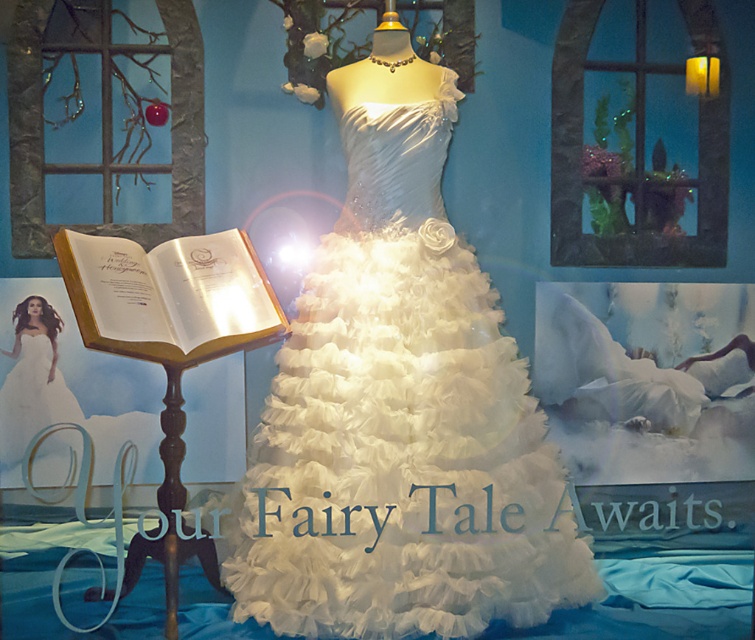
Does point (359, 296) lie behind point (666, 417)?

No, it is in front of (666, 417).

Is the position of white tulle dress at center less distant than that of white fluffy dress at center?

Yes, white tulle dress at center is in front of white fluffy dress at center.

The height and width of the screenshot is (640, 755). What do you see at coordinates (401, 426) in the screenshot?
I see `white tulle dress at center` at bounding box center [401, 426].

Identify the location of white tulle dress at center. This screenshot has height=640, width=755. (401, 426).

Who is lower down, white tulle dress at center or translucent glass at upper right?

Positioned lower is white tulle dress at center.

Between white tulle dress at center and translucent glass at upper right, which one has more height?

Standing taller between the two is white tulle dress at center.

Between point (427, 211) and point (604, 216), which one is positioned in front?

Point (427, 211)

This screenshot has width=755, height=640. I want to click on white tulle dress at center, so click(401, 426).

Who is more forward, (556, 232) or (14, 458)?

Point (14, 458) is more forward.

Can you confirm if translucent glass at upper right is positioned to the left of white tulle dress at left?

In fact, translucent glass at upper right is to the right of white tulle dress at left.

The width and height of the screenshot is (755, 640). Identify the location of translucent glass at upper right. (636, 141).

Find the location of a particular element. This screenshot has width=755, height=640. translucent glass at upper right is located at coordinates (636, 141).